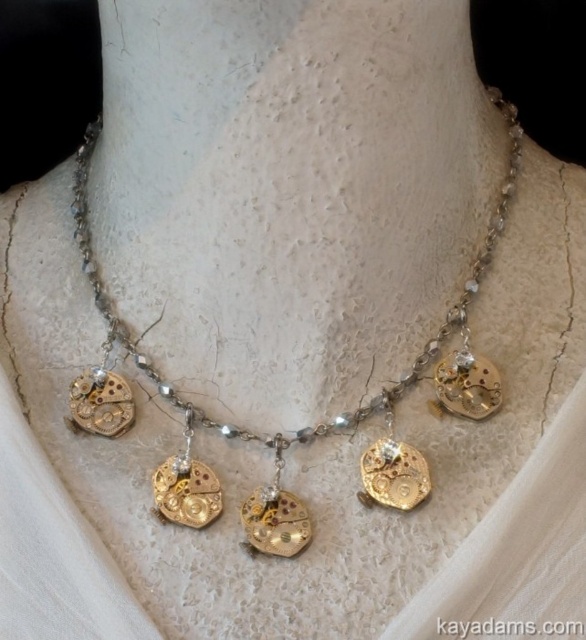
You are an appraiser examining the necklace displayed on the mannequin bust. You need to determine the exact location of the gold metallic watch parts at center. What are their coordinates?

The gold metallic watch parts at center are located at coordinates point (298,429).